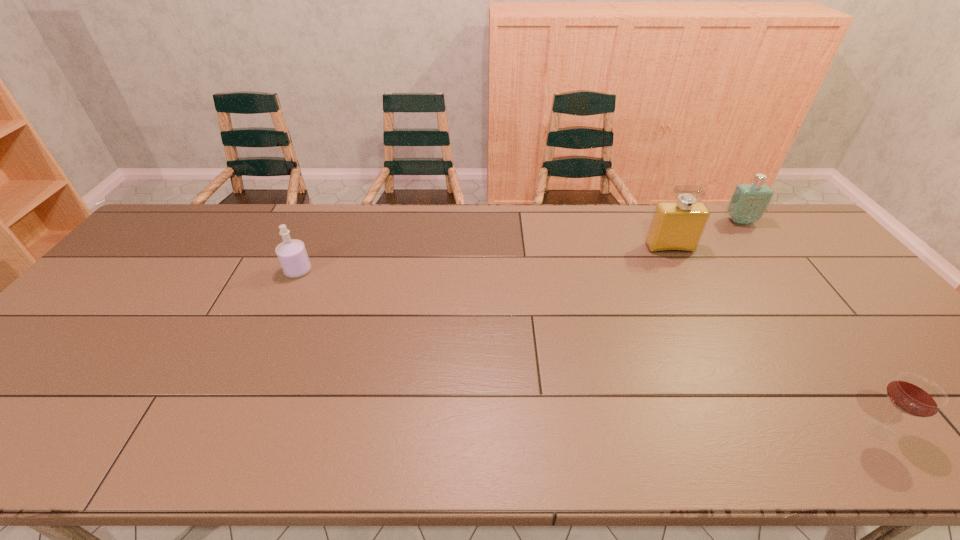
Identify the location of vacant space located on the left of the nearest object. Image resolution: width=960 pixels, height=540 pixels. (798, 429).

Where is `object located in the near edge section of the desktop`? object located in the near edge section of the desktop is located at coordinates (915, 395).

Locate an element on the screen. object that is positioned at the right edge is located at coordinates (749, 201).

Locate an element on the screen. This screenshot has height=540, width=960. object at the far right corner is located at coordinates (749, 201).

Locate an element on the screen. This screenshot has height=540, width=960. free spot at the far edge of the desktop is located at coordinates (482, 212).

In the image, there is a desktop. Where is `vacant space at the near edge`? The height and width of the screenshot is (540, 960). vacant space at the near edge is located at coordinates (771, 437).

Where is `free region at the left edge of the desktop`? This screenshot has height=540, width=960. free region at the left edge of the desktop is located at coordinates (101, 291).

Where is `vacant region at the far right corner`? The height and width of the screenshot is (540, 960). vacant region at the far right corner is located at coordinates (783, 224).

Locate an element on the screen. The image size is (960, 540). vacant point located between the rightmost perfume and the nearest object is located at coordinates (809, 325).

Locate an element on the screen. empty location between the leftmost object and the wineglass is located at coordinates pyautogui.click(x=588, y=350).